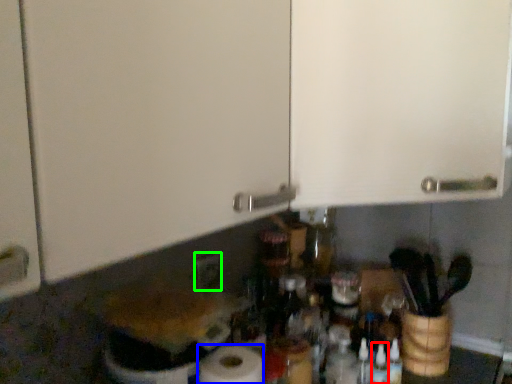
Question: Estimate the real-world distances between objects in this image. Which object is closer to bottle (highlighted by a red box), paper towel (highlighted by a blue box) or electric outlet (highlighted by a green box)?

Choices:
 (A) paper towel
 (B) electric outlet

Answer: (A)